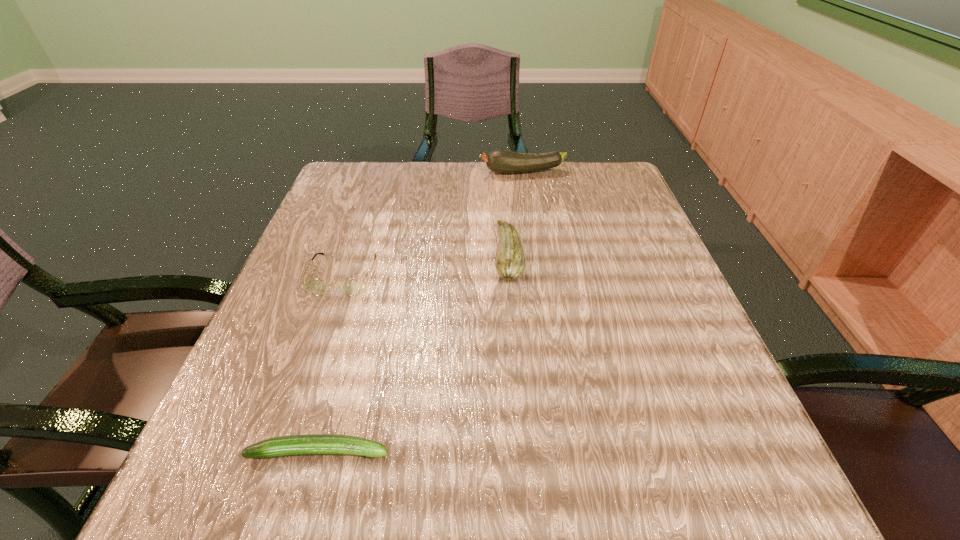
What are the coordinates of `free point located at the stem end of the second nearest zucchini` in the screenshot? It's located at 469,255.

Find the location of `vacant space located 0.090m on the lenses of the second shortest object`. vacant space located 0.090m on the lenses of the second shortest object is located at coordinates (323, 335).

The image size is (960, 540). In order to click on free space located 0.210m on the front-facing side of the leftmost zucchini in this screenshot , I will do [549, 451].

At what (x,y) coordinates should I click in order to perform the action: click on object present at the far edge. Please return your answer as a coordinate pair (x, y). Looking at the image, I should click on (500, 161).

Image resolution: width=960 pixels, height=540 pixels. In order to click on object at the near edge in this screenshot , I will do tap(312, 444).

The image size is (960, 540). In order to click on spectacles present at the left edge in this screenshot , I will do pyautogui.click(x=351, y=287).

I want to click on zucchini at the left edge, so click(312, 444).

The image size is (960, 540). I want to click on object located at the right edge, so click(x=500, y=161).

Find the location of a particular element. The width and height of the screenshot is (960, 540). object located in the near left corner section of the desktop is located at coordinates (312, 444).

Image resolution: width=960 pixels, height=540 pixels. I want to click on object that is at the far right corner, so click(500, 161).